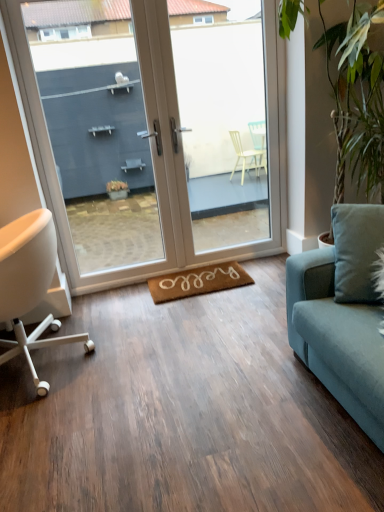
What is the approximate height of green leafy plant at right?

5.71 feet.

The image size is (384, 512). Describe the element at coordinates (155, 147) in the screenshot. I see `white glossy door at center` at that location.

Where is `white glossy door at center`? The image size is (384, 512). white glossy door at center is located at coordinates (155, 147).

This screenshot has width=384, height=512. Describe the element at coordinates (198, 282) in the screenshot. I see `brown coir yoga mat at center` at that location.

At what (x,y) coordinates should I click in order to perform the action: click on brown coir yoga mat at center. Please return your answer as a coordinate pair (x, y). Image resolution: width=384 pixels, height=512 pixels. Looking at the image, I should click on (198, 282).

Locate an element on the screen. This screenshot has height=512, width=384. green leafy plant at right is located at coordinates (356, 94).

Between white matte chair at left and brown coir yoga mat at center, which one has less height?

With less height is brown coir yoga mat at center.

Is white matte chair at left to the left of brown coir yoga mat at center from the viewer's perspective?

Yes, white matte chair at left is to the left of brown coir yoga mat at center.

Which point is more distant from viewer, (2, 245) or (175, 274)?

Positioned behind is point (175, 274).

Is white matte chair at left looking in the opposite direction of brown coir yoga mat at center?

Yes, white matte chair at left is positioned with its back facing brown coir yoga mat at center.

Is green leafy plant at right facing towards white matte chair at left?

Yes, green leafy plant at right is facing white matte chair at left.

Is green leafy plant at right taller than white matte chair at left?

Indeed, green leafy plant at right has a greater height compared to white matte chair at left.

From the image's perspective, is green leafy plant at right on white matte chair at left?

Indeed, from the image's perspective, green leafy plant at right is shown above white matte chair at left.

Can you confirm if green leafy plant at right is smaller than white matte chair at left?

No.

Based on the photo, what's the angular difference between transparent glass door at center and green leafy plant at right's facing directions?

89.9 degrees.

Is transparent glass door at center positioned beyond the bounds of green leafy plant at right?

Yes.

Can you confirm if transparent glass door at center is bigger than green leafy plant at right?

No, transparent glass door at center is not bigger than green leafy plant at right.

From the image's perspective, is transparent glass door at center located above or below green leafy plant at right?

From the image's perspective, transparent glass door at center appears above green leafy plant at right.

From the image's perspective, who appears lower, transparent glass door at center or white matte chair at left?

From the image's view, white matte chair at left is below.

Who is bigger, transparent glass door at center or white matte chair at left?

With larger size is white matte chair at left.

Does transparent glass door at center turn towards white matte chair at left?

No, transparent glass door at center does not turn towards white matte chair at left.

Considering the sizes of white matte chair at left and transparent glass door at center in the image, is white matte chair at left bigger or smaller than transparent glass door at center?

Clearly, white matte chair at left is larger in size than transparent glass door at center.

Which is behind, white matte chair at left or transparent glass door at center?

Positioned behind is transparent glass door at center.

How many degrees apart are the facing directions of white matte chair at left and transparent glass door at center?

The angular difference between white matte chair at left and transparent glass door at center is 88.4 degrees.

From the image's perspective, between green leafy plant at right and brown coir yoga mat at center, which one is located above?

green leafy plant at right.

Is green leafy plant at right bigger than brown coir yoga mat at center?

Yes, green leafy plant at right is bigger than brown coir yoga mat at center.

Is green leafy plant at right facing towards brown coir yoga mat at center?

No, green leafy plant at right is not aimed at brown coir yoga mat at center.

Which is nearer, (350, 80) or (171, 282)?

Point (350, 80).

Is white glossy door at center to the left of green leafy plant at right from the viewer's perspective?

Indeed, white glossy door at center is positioned on the left side of green leafy plant at right.

Does white glossy door at center have a lesser height compared to green leafy plant at right?

In fact, white glossy door at center may be taller than green leafy plant at right.

Relative to green leafy plant at right, is white glossy door at center in front or behind?

Visually, white glossy door at center is located behind green leafy plant at right.

Which point is more distant from viewer, (157, 161) or (372, 18)?

The point (157, 161) is farther.

Find the location of a particular element. This screenshot has height=512, width=384. yoga mat above the white matte chair at left (from the image's perspective) is located at coordinates (198, 282).

Find the location of a particular element. This screenshot has width=384, height=512. chair below the green leafy plant at right (from a real-world perspective) is located at coordinates (30, 286).

Considering their positions, is white matte chair at left positioned closer to green leafy plant at right than brown coir yoga mat at center?

brown coir yoga mat at center is positioned closer to the anchor green leafy plant at right.

Considering their positions, is white glossy door at center positioned closer to green leafy plant at right than brown coir yoga mat at center?

white glossy door at center lies closer to green leafy plant at right than the other object.

Looking at the image, which one is located closer to transparent glass door at center, white glossy door at center or white matte chair at left?

white glossy door at center lies closer to transparent glass door at center than the other object.

Estimate the real-world distances between objects in this image. Which object is closer to white glossy door at center, green leafy plant at right or transparent glass door at center?

green leafy plant at right.

From the image, which object appears to be nearer to transparent glass door at center, white matte chair at left or white glossy door at center?

Based on the image, white glossy door at center appears to be nearer to transparent glass door at center.

From the image, which object appears to be nearer to transparent glass door at center, green leafy plant at right or white glossy door at center?

white glossy door at center lies closer to transparent glass door at center than the other object.

Based on their spatial positions, is white glossy door at center or green leafy plant at right further from white matte chair at left?

green leafy plant at right lies further to white matte chair at left than the other object.

When comparing their distances from brown coir yoga mat at center, does green leafy plant at right or white glossy door at center seem closer?

Based on the image, white glossy door at center appears to be nearer to brown coir yoga mat at center.

Image resolution: width=384 pixels, height=512 pixels. Identify the location of door between white matte chair at left and green leafy plant at right from left to right. click(x=155, y=147).

Where is `door between white matte chair at left and transparent glass door at center from left to right`? door between white matte chair at left and transparent glass door at center from left to right is located at coordinates (155, 147).

This screenshot has width=384, height=512. Identify the location of yoga mat between white matte chair at left and transparent glass door at center from left to right. (198, 282).

I want to click on window screen situated between white matte chair at left and green leafy plant at right from left to right, so click(x=227, y=125).